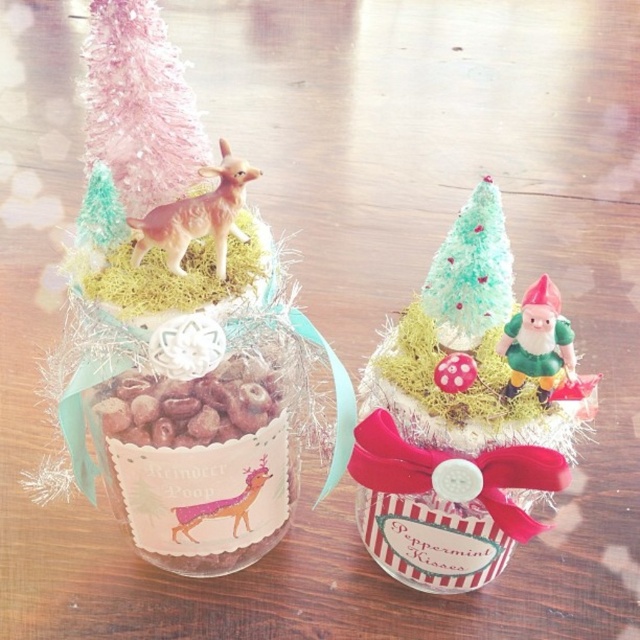
Question: Does pink fluffy christmas tree at upper left appear under green matte/glossy gnome at upper right?

Choices:
 (A) no
 (B) yes

Answer: (A)

Question: Which point is closer to the camera taking this photo?

Choices:
 (A) tap(536, 346)
 (B) tap(131, 225)

Answer: (A)

Question: Among these points, which one is farthest from the camera?

Choices:
 (A) (108, 12)
 (B) (536, 392)
 (C) (243, 518)

Answer: (C)

Question: Is pink fluffy christmas tree at upper left to the left of green matte/glossy gnome at upper right from the viewer's perspective?

Choices:
 (A) yes
 (B) no

Answer: (A)

Question: Can you confirm if pink fluffy christmas tree at upper left is thinner than brown plastic toy deer at upper left?

Choices:
 (A) no
 (B) yes

Answer: (B)

Question: Which of these objects is positioned farthest from the brown plastic toy deer at upper left?

Choices:
 (A) green matte/glossy gnome at upper right
 (B) pink fluffy christmas tree at upper left
 (C) matte pink deer at left
 (D) frosted mint green christmas tree at center

Answer: (C)